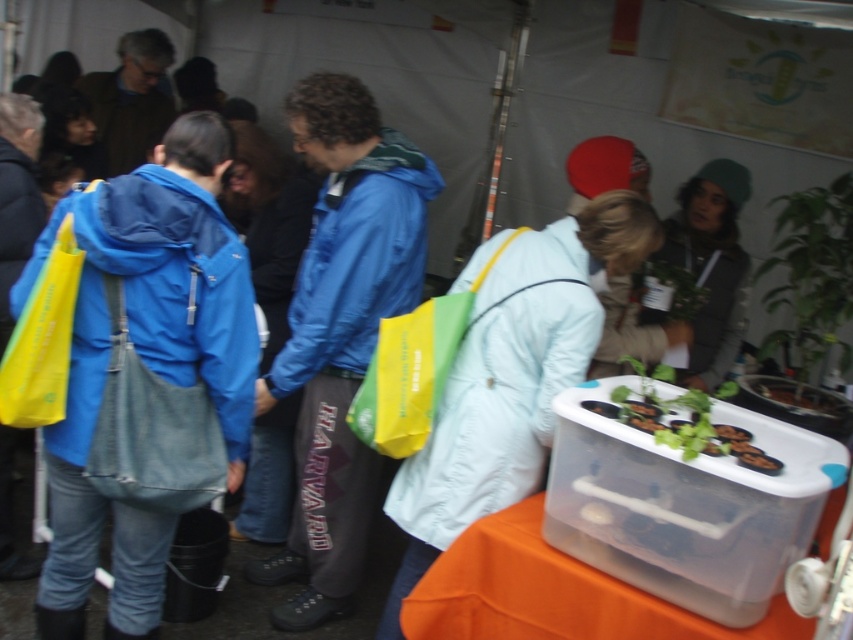
You are organizing a photo shoot and need to place the matte blue jacket at center and the green leafy plant at right in a way that they are both visible in the frame. Considering their thickness, which object should be placed closer to the camera to ensure both are fully visible?

The matte blue jacket at center is thinner than the green leafy plant at right, so placing the thicker green leafy plant at right closer to the camera will allow both objects to be fully visible in the frame.

You are at the event and want to greet the person wearing the blue fabric jacket at left and the matte blue jacket at center. Which person should you approach first if you want to start with the one closer to the entrance?

The blue fabric jacket at left is to the left of the matte blue jacket at center, so the person wearing the blue fabric jacket at left is closer to the entrance and should be approached first.

Please provide the coordinates of the blue fabric jacket at left in the image. The coordinates should be in the format of a point with two decimal places, such as 0.5,0.5.

The coordinates of the blue fabric jacket at left are at point (155,300).